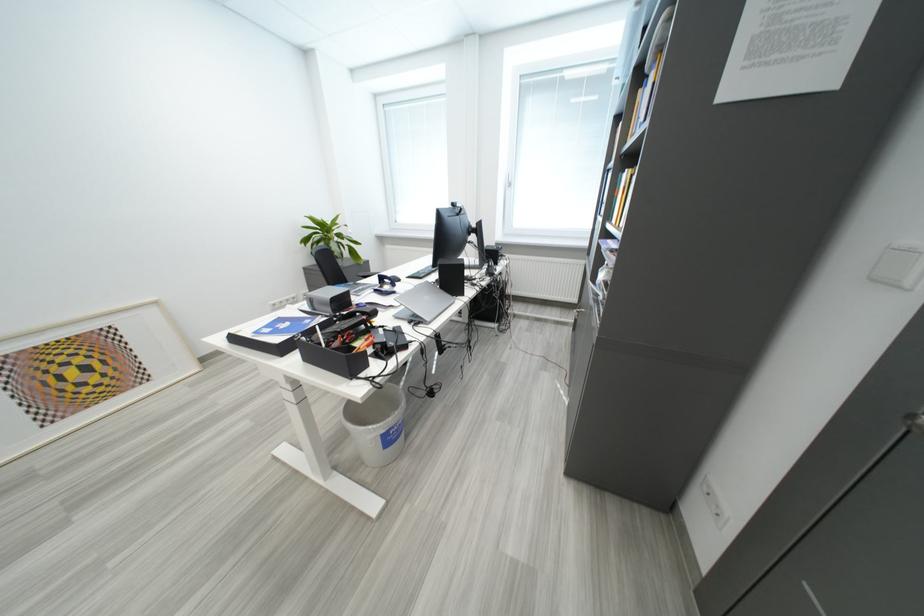
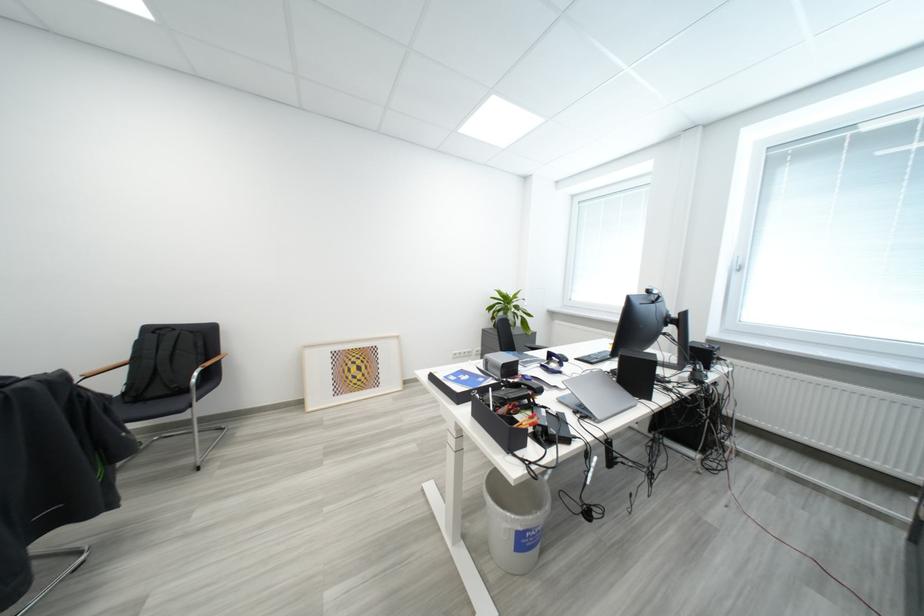
Question: The camera is either moving clockwise (left) or counter-clockwise (right) around the object. The first image is from the beginning of the video and the second image is from the end. Is the camera moving left or right when shooting the video?

Choices:
 (A) Left
 (B) Right

Answer: (B)